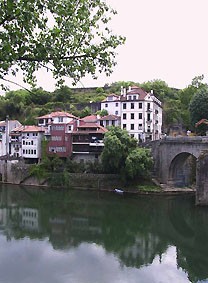
Where is `wall`? wall is located at coordinates (86, 184).